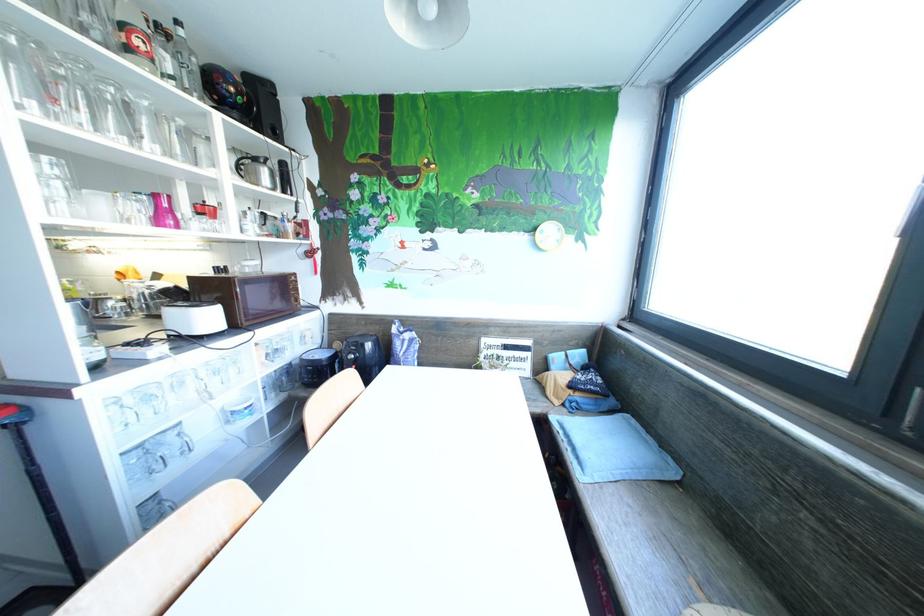
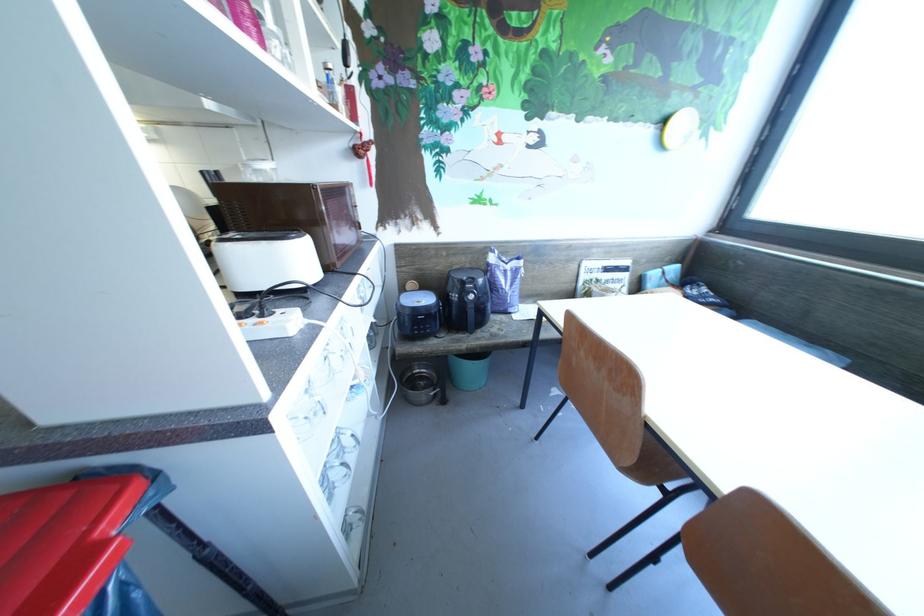
In a continuous first-person perspective shot, in which direction is the camera moving?

→ The cameraman moved toward left, forward.